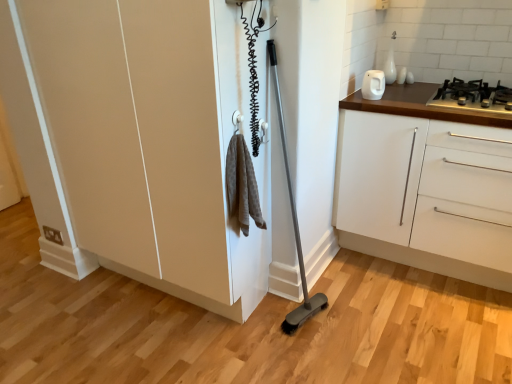
Identify the location of vacant area that is in front of matte beige cupboard at center. The image size is (512, 384). (152, 349).